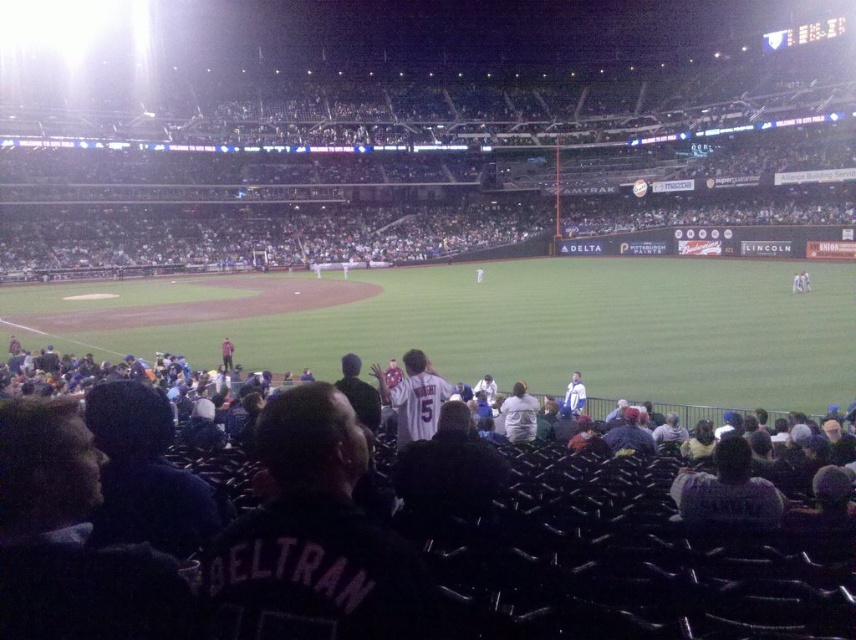
Question: Can you confirm if dark gray jacket at center is wider than white jersey at center?

Choices:
 (A) no
 (B) yes

Answer: (A)

Question: Which of the following is the farthest from the observer?

Choices:
 (A) white jersey at center
 (B) dark gray jacket at center

Answer: (A)

Question: Which of the following is the closest to the observer?

Choices:
 (A) (438, 397)
 (B) (688, 509)

Answer: (B)

Question: Which object is closer to the camera taking this photo?

Choices:
 (A) dark gray jacket at center
 (B) white jersey at center

Answer: (A)

Question: Can you confirm if dark gray jacket at center is positioned above white jersey at center?

Choices:
 (A) no
 (B) yes

Answer: (A)

Question: Is dark gray jacket at center above white jersey at center?

Choices:
 (A) no
 (B) yes

Answer: (A)